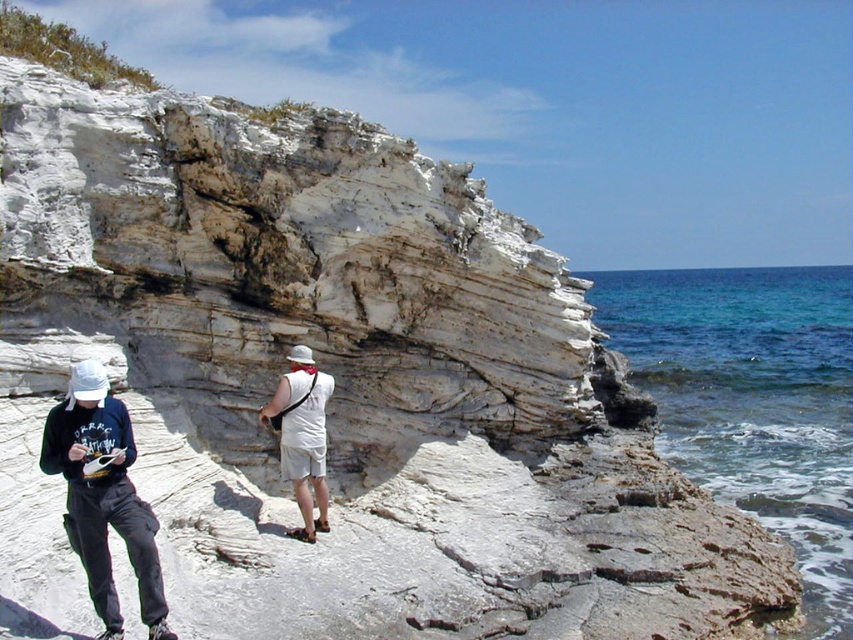
Question: Estimate the real-world distances between objects in this image. Which object is closer to the clear blue water at lower right?

Choices:
 (A) white cotton shirt at center
 (B) dark blue cotton hoodie at lower left

Answer: (B)

Question: Does dark blue cotton hoodie at lower left lie in front of matte black hoodie at lower left?

Choices:
 (A) yes
 (B) no

Answer: (A)

Question: Based on their relative distances, which object is farther from the dark blue cotton hoodie at lower left?

Choices:
 (A) white cotton shirt at center
 (B) clear blue water at lower right

Answer: (B)

Question: Is dark blue cotton hoodie at lower left below matte black hoodie at lower left?

Choices:
 (A) yes
 (B) no

Answer: (A)

Question: Where is clear blue water at lower right located in relation to white cotton shirt at center in the image?

Choices:
 (A) above
 (B) below

Answer: (A)

Question: Which object is closer to the camera taking this photo?

Choices:
 (A) matte black hoodie at lower left
 (B) clear blue water at lower right
 (C) white cotton shirt at center
 (D) dark blue cotton hoodie at lower left

Answer: (D)